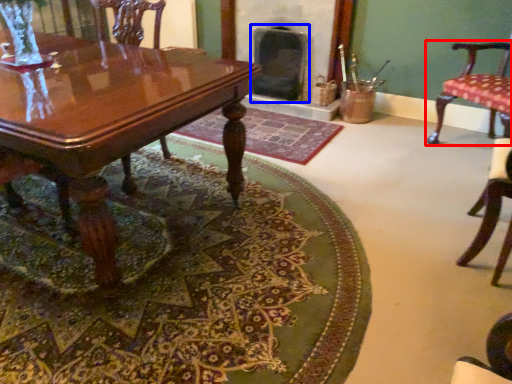
Question: Which object is closer to the camera taking this photo, chair (highlighted by a red box) or fireplace (highlighted by a blue box)?

Choices:
 (A) chair
 (B) fireplace

Answer: (A)